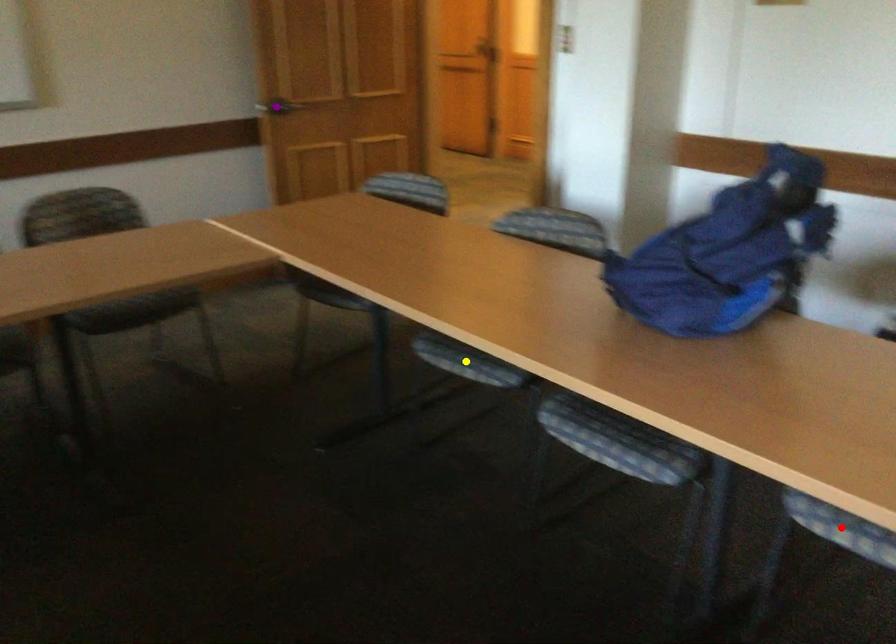
Order these from nearest to farthest:
yellow point, purple point, red point

1. red point
2. yellow point
3. purple point